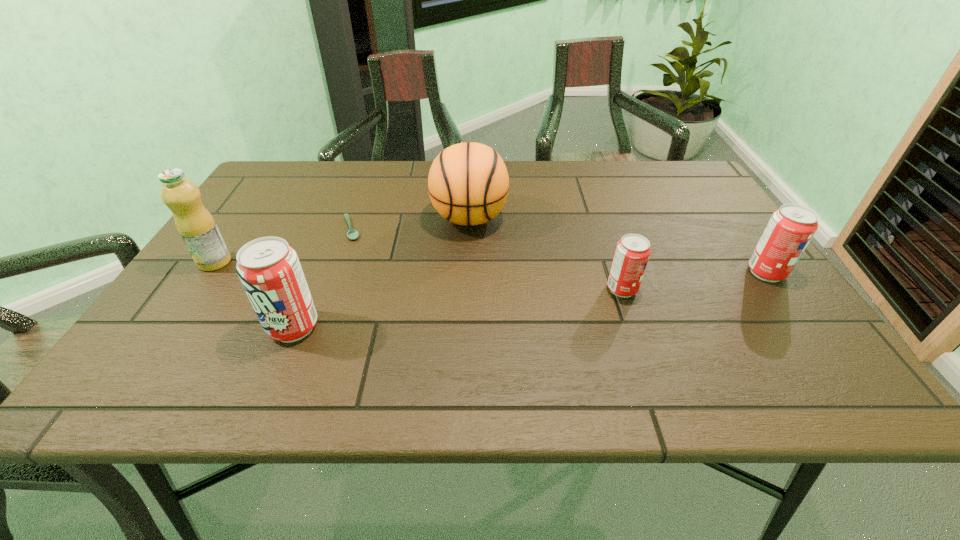
The image size is (960, 540). I want to click on free region at the near edge of the desktop, so 579,325.

The image size is (960, 540). In order to click on blank area at the left edge in this screenshot , I will do `click(276, 206)`.

Locate an element on the screen. Image resolution: width=960 pixels, height=540 pixels. free location at the right edge is located at coordinates (671, 213).

This screenshot has height=540, width=960. In order to click on blank area at the far left corner in this screenshot , I will do `click(303, 200)`.

Locate an element on the screen. Image resolution: width=960 pixels, height=540 pixels. vacant area between the third shortest object and the second soda can from left to right is located at coordinates (694, 281).

You are a GUI agent. You are given a task and a screenshot of the screen. Output one action in this format:
    pyautogui.click(x=<x>, y=<y>)
    Task: Click on the empty location between the fruit juice and the basketball
    
    Given the screenshot: What is the action you would take?
    pyautogui.click(x=342, y=240)

The width and height of the screenshot is (960, 540). I want to click on free spot between the nearest soda can and the second shortest soda can, so click(x=530, y=300).

At what (x,y) coordinates should I click in order to perform the action: click on vacant point located between the fruit juice and the fourth object from left to right. Please return your answer as a coordinate pair (x, y). The height and width of the screenshot is (540, 960). Looking at the image, I should click on (342, 240).

This screenshot has width=960, height=540. Find the location of `vacant area that lies between the rightmost object and the fruit juice`. vacant area that lies between the rightmost object and the fruit juice is located at coordinates (491, 267).

Identify the location of free area in between the tallest soda can and the third shortest object. Image resolution: width=960 pixels, height=540 pixels. (530, 300).